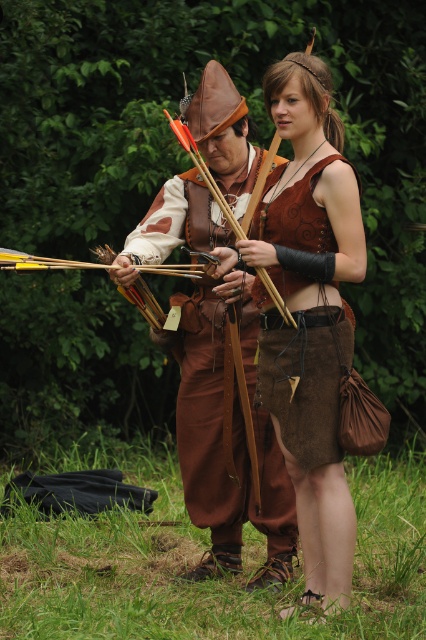
Question: Does brown suede vest at center have a smaller size compared to leather bow at center?

Choices:
 (A) no
 (B) yes

Answer: (B)

Question: Is brown leather bow at center to the right of brown suede vest at center from the viewer's perspective?

Choices:
 (A) yes
 (B) no

Answer: (B)

Question: Among these objects, which one is nearest to the camera?

Choices:
 (A) brown suede vest at center
 (B) leather bow at center

Answer: (A)

Question: Which point is farther to the camera?

Choices:
 (A) (333, 352)
 (B) (249, 515)
 (C) (284, 314)

Answer: (B)

Question: Can you confirm if brown leather bow at center is bigger than brown suede vest at center?

Choices:
 (A) yes
 (B) no

Answer: (A)

Question: Which point appears closest to the camera in this image?

Choices:
 (A) (331, 342)
 (B) (265, 289)

Answer: (A)